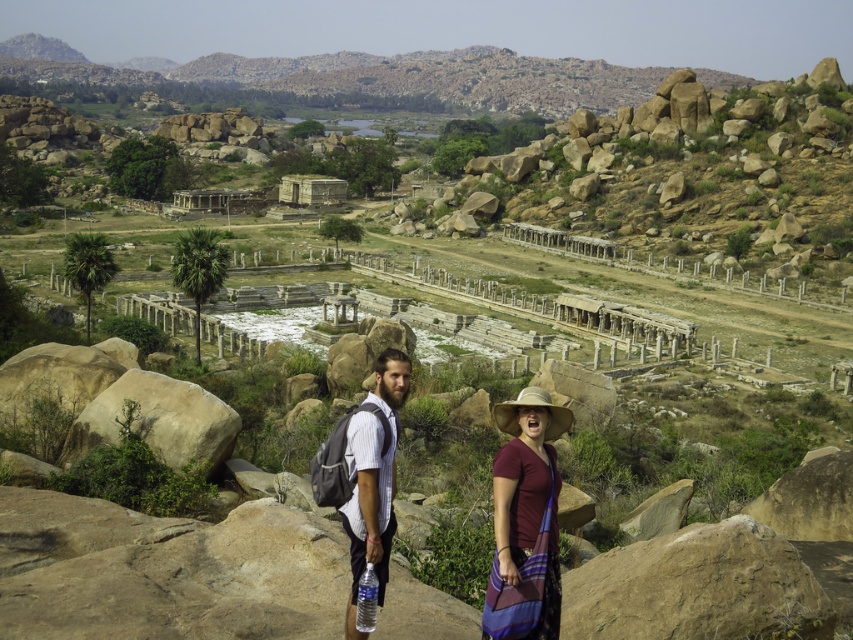
You are planning to hike through the rocky terrain at upper center and the maroon fabric shirt at center is your friend standing there. Since you need to pass through the narrowest part of the path, which area should you avoid if the path is narrower than your backpack?

You should avoid the maroon fabric shirt at center because the rocky terrain at upper center is wider than the maroon fabric shirt at center, so the area near the friend is narrower.

You are standing at the base of the ruins and want to reach the rocky terrain at upper center. Given that the average human walking speed is 5 km per hour, how many minutes would it take to walk there?

The rocky terrain at upper center is 508.35 meters away from the viewer. At an average walking speed of 5 km per hour, it would take approximately 6.1 minutes to reach there.

You are a hiker who wants to reach the ancient temple ruins located at the rocky terrain at upper center. You are currently standing near the maroon fabric shirt at center. Which direction should you move to reach the ruins?

The rocky terrain at upper center is positioned on the left side of maroon fabric shirt at center, so you should move to the left to reach the ruins.